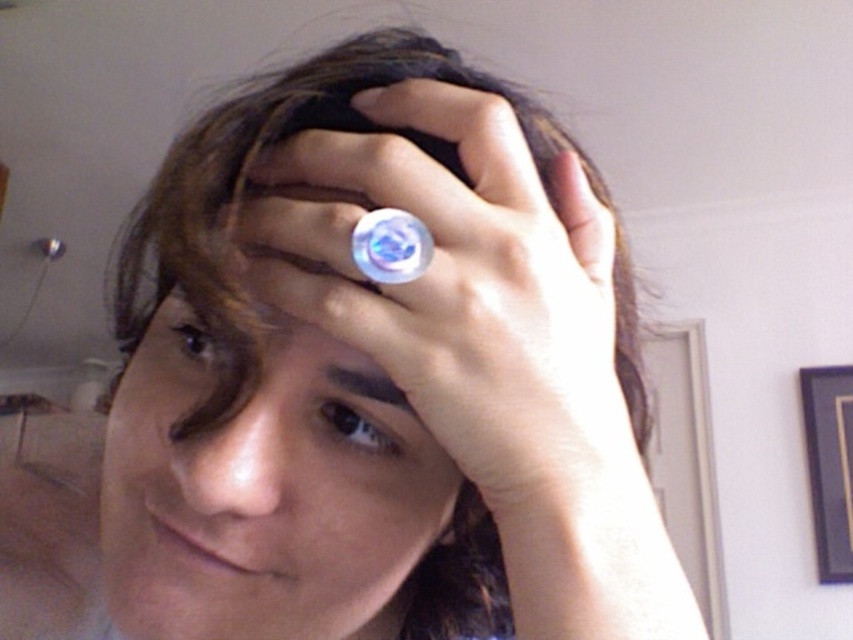
Which is behind, point (508, 429) or point (181, 310)?

Point (181, 310)

Between transparent plastic ring at center and brown glossy eye at upper left, which one appears on the right side from the viewer's perspective?

From the viewer's perspective, transparent plastic ring at center appears more on the right side.

Locate an element on the screen. The width and height of the screenshot is (853, 640). transparent plastic ring at center is located at coordinates (468, 292).

The height and width of the screenshot is (640, 853). What do you see at coordinates (198, 340) in the screenshot?
I see `brown glossy eye at upper left` at bounding box center [198, 340].

Find the location of a particular element. The width and height of the screenshot is (853, 640). brown glossy eye at upper left is located at coordinates (198, 340).

Find the location of a particular element. The height and width of the screenshot is (640, 853). brown glossy eye at upper left is located at coordinates (198, 340).

Does smooth skin face at center have a smaller size compared to satin black eye at center?

No.

Image resolution: width=853 pixels, height=640 pixels. Describe the element at coordinates (267, 493) in the screenshot. I see `smooth skin face at center` at that location.

Locate an element on the screen. The width and height of the screenshot is (853, 640). smooth skin face at center is located at coordinates (267, 493).